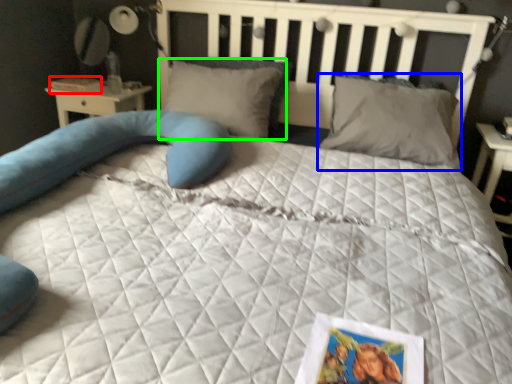
Question: Based on their relative distances, which object is nearer to book (highlighted by a red box)? Choose from pillow (highlighted by a blue box) and pillow (highlighted by a green box).

Choices:
 (A) pillow
 (B) pillow

Answer: (B)